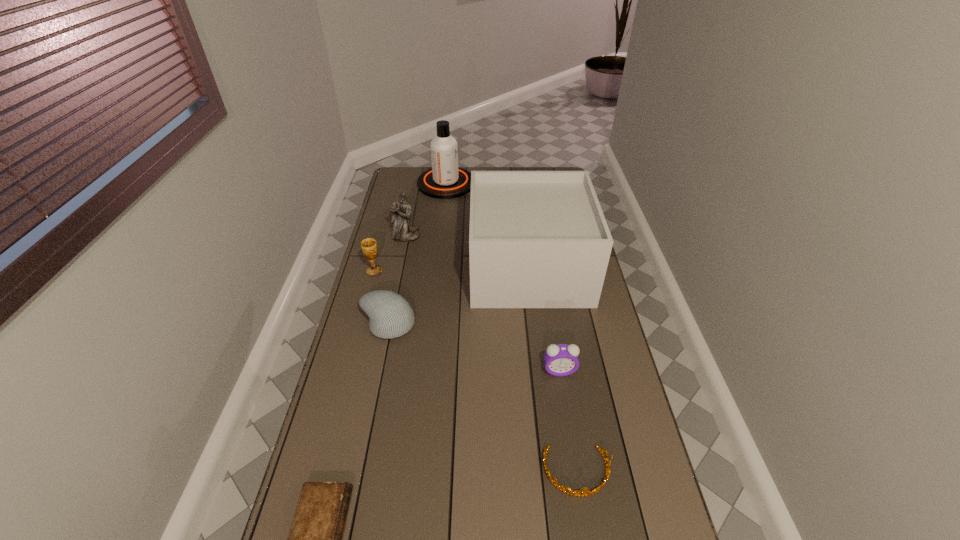
I want to click on beanie that is at the left edge, so click(x=390, y=315).

Where is `box positioned at the right edge`? box positioned at the right edge is located at coordinates (538, 239).

What are the coordinates of `alarm clock positioned at the right edge` in the screenshot? It's located at (560, 360).

The width and height of the screenshot is (960, 540). I want to click on tiara present at the right edge, so click(578, 493).

Where is `object that is at the far left corner`? The width and height of the screenshot is (960, 540). object that is at the far left corner is located at coordinates (445, 180).

The height and width of the screenshot is (540, 960). In the image, there is a desktop. What are the coordinates of `vacant region at the left edge` in the screenshot? It's located at (378, 415).

Locate an element on the screen. The height and width of the screenshot is (540, 960). vacant space at the far left corner of the desktop is located at coordinates (425, 169).

Locate an element on the screen. Image resolution: width=960 pixels, height=540 pixels. free spot between the third nearest object and the chalice is located at coordinates [x=467, y=321].

This screenshot has width=960, height=540. I want to click on vacant area between the beanie and the box, so click(x=458, y=295).

The height and width of the screenshot is (540, 960). I want to click on blank region between the seventh tallest object and the alarm clock, so click(x=568, y=421).